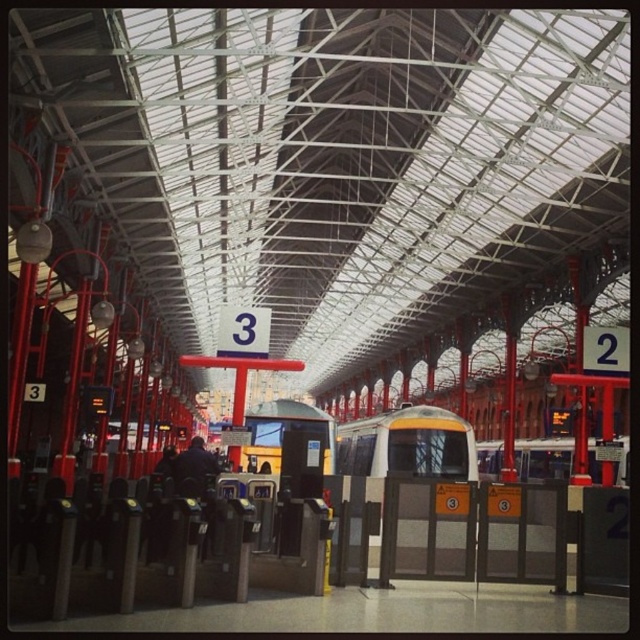
In the scene shown: You are standing on the train station platform and want to reach the point marked as point (368, 461). If you walk straight ahead, will you reach that point before walking 40 meters?

The distance between you and point (368, 461) is 38.31 meters, so yes, you will reach it before walking 40 meters.

You are a passenger waiting at the train station platform. You see two trains at the center of the platform, a yellow and white train at center and a yellow metallic train at center. Which train has a smaller width?

The yellow and white train at center is thinner than the yellow metallic train at center, so the yellow and white train at center has a smaller width.